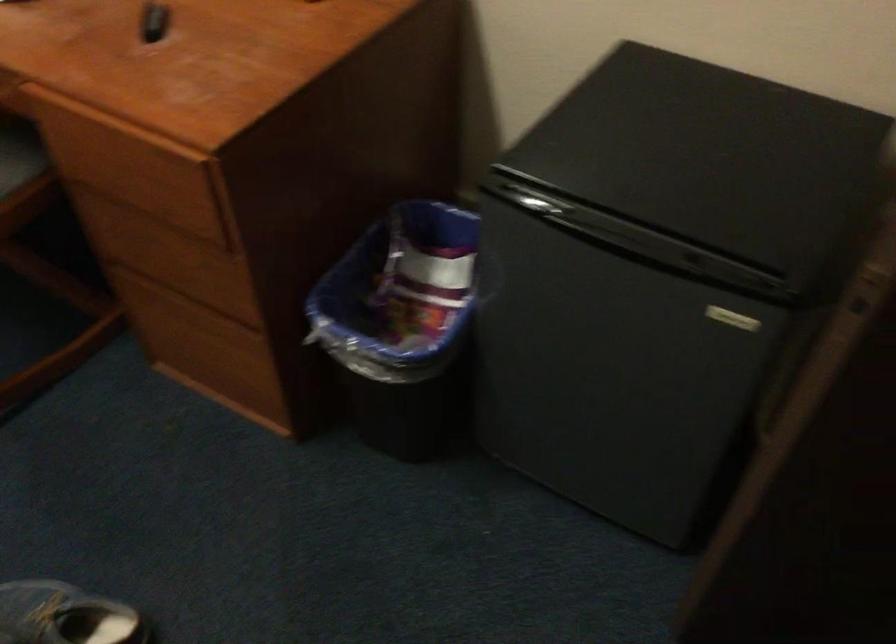
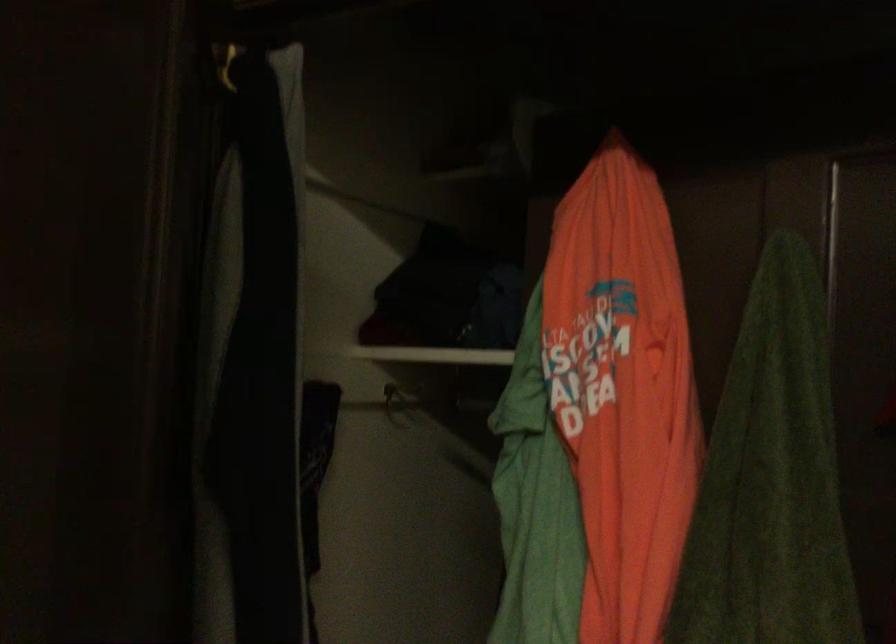
Question: The images are taken continuously from a first-person perspective. In which direction is your viewpoint rotating?

Choices:
 (A) Left
 (B) Right
 (C) Up
 (D) Down

Answer: (B)